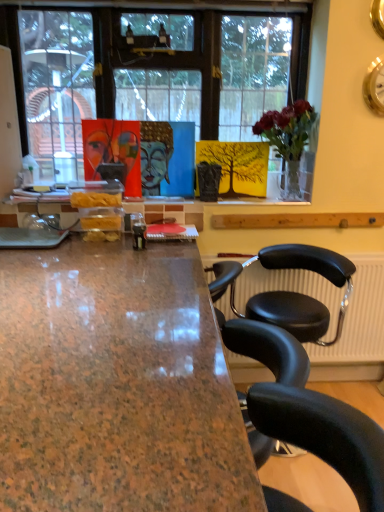
Question: Which direction should I rotate to look at matte acrylic painting of a human face at upper center?

Choices:
 (A) right
 (B) left

Answer: (B)

Question: Can you confirm if matte acrylic painting of a human face at upper center is positioned to the right of brown polished granite desk at center?

Choices:
 (A) no
 (B) yes

Answer: (A)

Question: From the image's perspective, is matte acrylic painting of a human face at upper center on brown polished granite desk at center?

Choices:
 (A) yes
 (B) no

Answer: (A)

Question: Is matte acrylic painting of a human face at upper center behind brown polished granite desk at center?

Choices:
 (A) yes
 (B) no

Answer: (A)

Question: From a real-world perspective, does matte acrylic painting of a human face at upper center stand above brown polished granite desk at center?

Choices:
 (A) no
 (B) yes

Answer: (B)

Question: Does matte acrylic painting of a human face at upper center appear on the left side of brown polished granite desk at center?

Choices:
 (A) no
 (B) yes

Answer: (B)

Question: Is matte acrylic painting of a human face at upper center completely or partially outside of brown polished granite desk at center?

Choices:
 (A) yes
 (B) no

Answer: (A)

Question: Is blue glossy buddha head at center smaller than brown polished granite desk at center?

Choices:
 (A) no
 (B) yes

Answer: (B)

Question: Is blue glossy buddha head at center aimed at brown polished granite desk at center?

Choices:
 (A) yes
 (B) no

Answer: (B)

Question: Is blue glossy buddha head at center completely or partially outside of brown polished granite desk at center?

Choices:
 (A) yes
 (B) no

Answer: (A)

Question: Does blue glossy buddha head at center touch brown polished granite desk at center?

Choices:
 (A) yes
 (B) no

Answer: (B)

Question: Does blue glossy buddha head at center lie in front of brown polished granite desk at center?

Choices:
 (A) yes
 (B) no

Answer: (B)

Question: Is blue glossy buddha head at center positioned far away from brown polished granite desk at center?

Choices:
 (A) yes
 (B) no

Answer: (A)

Question: Is blue glossy buddha head at center completely or partially outside of matte acrylic painting of a human face at upper center?

Choices:
 (A) no
 (B) yes

Answer: (B)